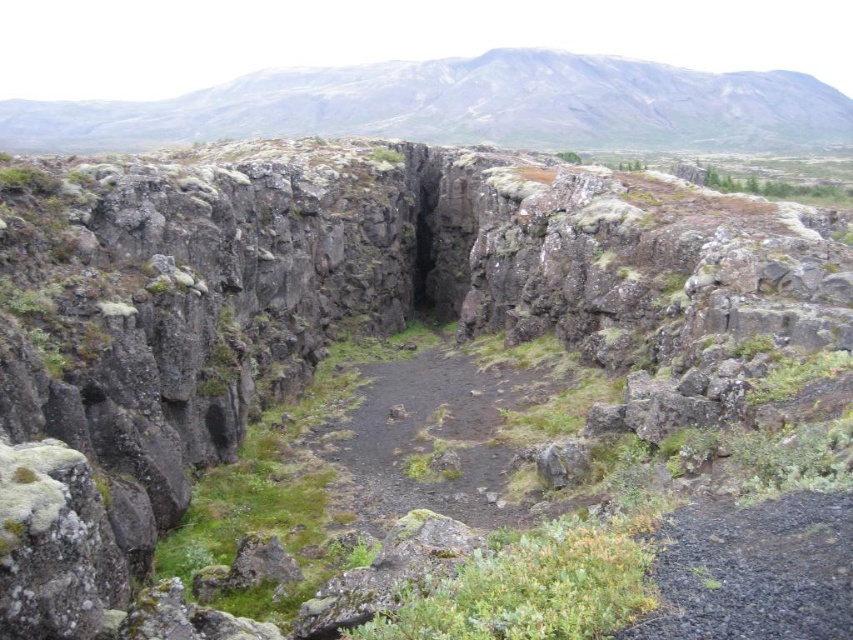
You are a hiker planning to cross the dull gray dirt path at center. You need to know if the gray rocky mountain at upper center is wider than the path to decide your route. Can you confirm this?

The gray rocky mountain at upper center is wider than the dull gray dirt path at center, so yes, the mountain is wider than the path.

You are a hiker standing at the edge of the fissure and want to reach the gray rocky mountain at upper center. Based on the distance provided, can you estimate how long it would take you to hike there if your average hiking speed is 2 miles per hour?

The gray rocky mountain at upper center is 1433.84 feet away. Converting feet to miles, 1433.84 feet is approximately 0.27 miles. At an average hiking speed of 2 mph, it would take roughly 8 minutes to reach the gray rocky mountain at upper center.